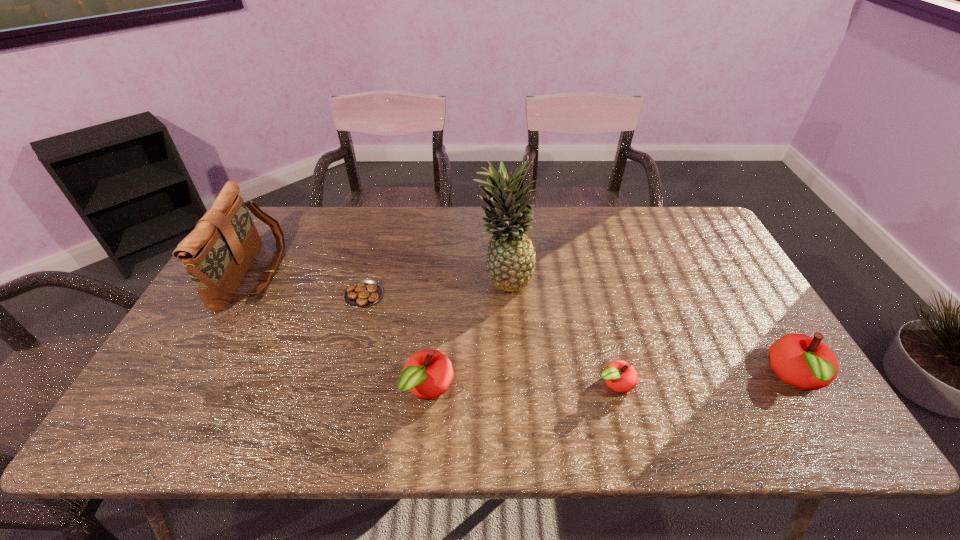
Find the location of a particular element. The height and width of the screenshot is (540, 960). vacant point located between the shoulder bag and the second tallest apple is located at coordinates (341, 331).

The image size is (960, 540). In order to click on free space that is in between the fourth tallest object and the second tallest object in this screenshot , I will do click(x=341, y=331).

This screenshot has height=540, width=960. I want to click on free space between the leftmost object and the tallest object, so click(x=378, y=275).

The width and height of the screenshot is (960, 540). I want to click on free point between the rightmost apple and the shortest object, so click(x=580, y=336).

At what (x,y) coordinates should I click in order to perform the action: click on unoccupied area between the rightmost apple and the leftmost object. Please return your answer as a coordinate pair (x, y). The image size is (960, 540). Looking at the image, I should click on (524, 326).

Where is `free space between the leftmost object and the leftmost apple`? free space between the leftmost object and the leftmost apple is located at coordinates (341, 331).

Find the location of a particular element. free space between the third object from left to right and the shortest object is located at coordinates (396, 341).

Locate which object ranks third in proximity to the shortest apple. Please provide its 2D coordinates. Your answer should be formatted as a tuple, i.e. [(x, y)], where the tuple contains the x and y coordinates of a point satisfying the conditions above.

[(427, 374)]

Select which object is the fifth closest to the fifth tallest object. Please provide its 2D coordinates. Your answer should be formatted as a tuple, i.e. [(x, y)], where the tuple contains the x and y coordinates of a point satisfying the conditions above.

[(217, 254)]

Locate an element on the screen. Image resolution: width=960 pixels, height=540 pixels. the closest apple to the rightmost apple is located at coordinates (621, 377).